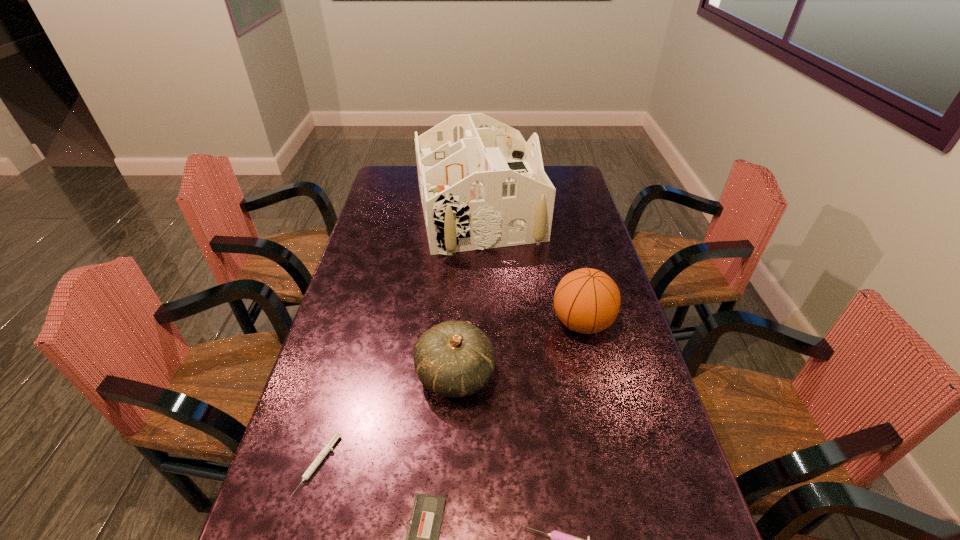
Find the location of a particular element. The width and height of the screenshot is (960, 540). object that stands as the second closest to the taller syringe is located at coordinates (454, 359).

Locate which object ranks in proximity to the farthest object. Please provide its 2D coordinates. Your answer should be formatted as a tuple, i.e. [(x, y)], where the tuple contains the x and y coordinates of a point satisfying the conditions above.

[(586, 300)]

Identify the location of vacant area that satisfies the following two spatial constraints: 1. on the back side of the fifth tallest object; 2. on the left side of the tallest object. This screenshot has height=540, width=960. (389, 214).

Find the location of `vacant area in the image that satisfies the following two spatial constraints: 1. on the back side of the basketball; 2. on the left side of the left syringe`. vacant area in the image that satisfies the following two spatial constraints: 1. on the back side of the basketball; 2. on the left side of the left syringe is located at coordinates (358, 323).